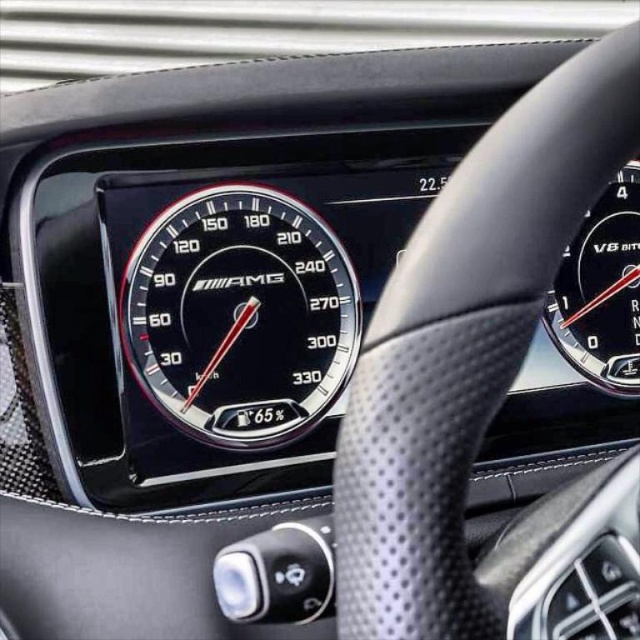
Question: Does black leather steering wheel at center have a lesser width compared to black glossy speedometer at upper right?

Choices:
 (A) no
 (B) yes

Answer: (A)

Question: Does black leather steering wheel at center appear on the left side of black glossy speedometer at center?

Choices:
 (A) no
 (B) yes

Answer: (A)

Question: Considering the real-world distances, which object is closest to the black leather steering wheel at center?

Choices:
 (A) black glossy speedometer at upper right
 (B) black glossy speedometer at center

Answer: (B)

Question: Estimate the real-world distances between objects in this image. Which object is closer to the black glossy speedometer at center?

Choices:
 (A) black glossy speedometer at upper right
 (B) black leather steering wheel at center

Answer: (B)

Question: Based on their relative distances, which object is farther from the black glossy speedometer at center?

Choices:
 (A) black leather steering wheel at center
 (B) black glossy speedometer at upper right

Answer: (B)

Question: Is black glossy speedometer at center further to the viewer compared to black glossy speedometer at upper right?

Choices:
 (A) yes
 (B) no

Answer: (B)